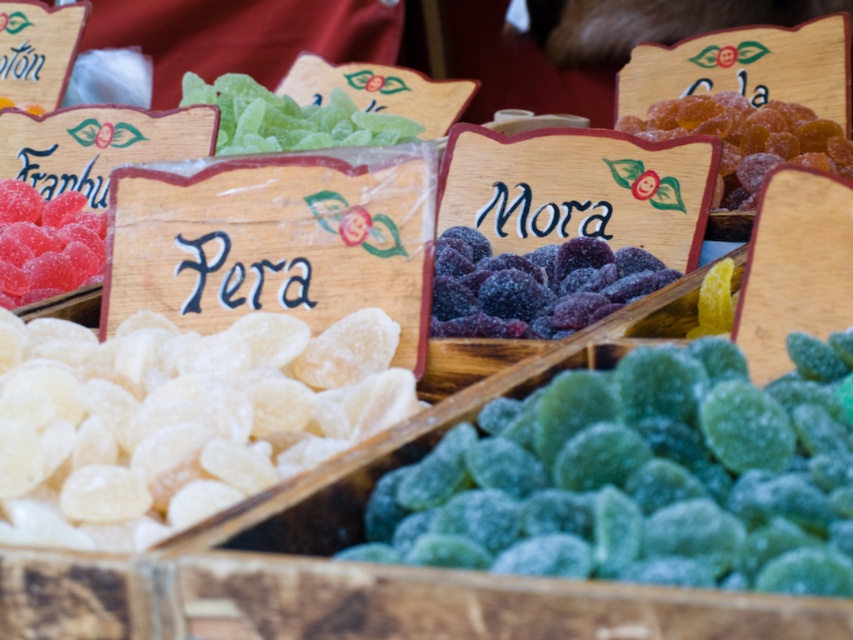
Does point (795, 120) lie behind point (6, 212)?

Yes, it is.

Does glossy amber gummy at upper right appear over glossy pink candy at upper left?

Correct, glossy amber gummy at upper right is located above glossy pink candy at upper left.

Describe the element at coordinates (747, 138) in the screenshot. The width and height of the screenshot is (853, 640). I see `glossy amber gummy at upper right` at that location.

Locate an element on the screen. Image resolution: width=853 pixels, height=640 pixels. glossy amber gummy at upper right is located at coordinates (747, 138).

Does point (495, 257) come in front of point (47, 209)?

Yes, it is in front of point (47, 209).

Between purple sugared candy at center and glossy pink candy at upper left, which one has less height?

With less height is purple sugared candy at center.

Describe the element at coordinates (534, 285) in the screenshot. I see `purple sugared candy at center` at that location.

Where is `purple sugared candy at center`? The width and height of the screenshot is (853, 640). purple sugared candy at center is located at coordinates (534, 285).

Looking at this image, between green sugared candy at center and glossy pink candy at upper left, which one appears on the right side from the viewer's perspective?

green sugared candy at center is more to the right.

Where is `green sugared candy at center`? The width and height of the screenshot is (853, 640). green sugared candy at center is located at coordinates (640, 477).